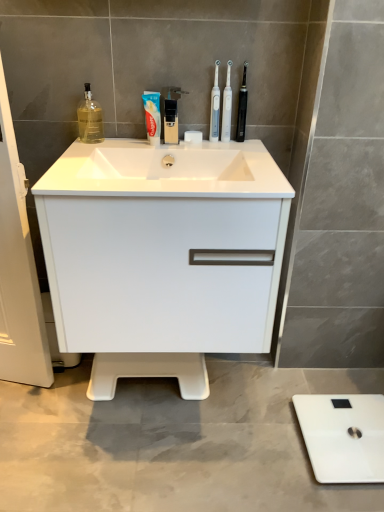
Locate an element on the screen. This screenshot has height=512, width=384. free spot in front of white glossy toothbrush at upper center, the 2th toothbrush from the left is located at coordinates (244, 153).